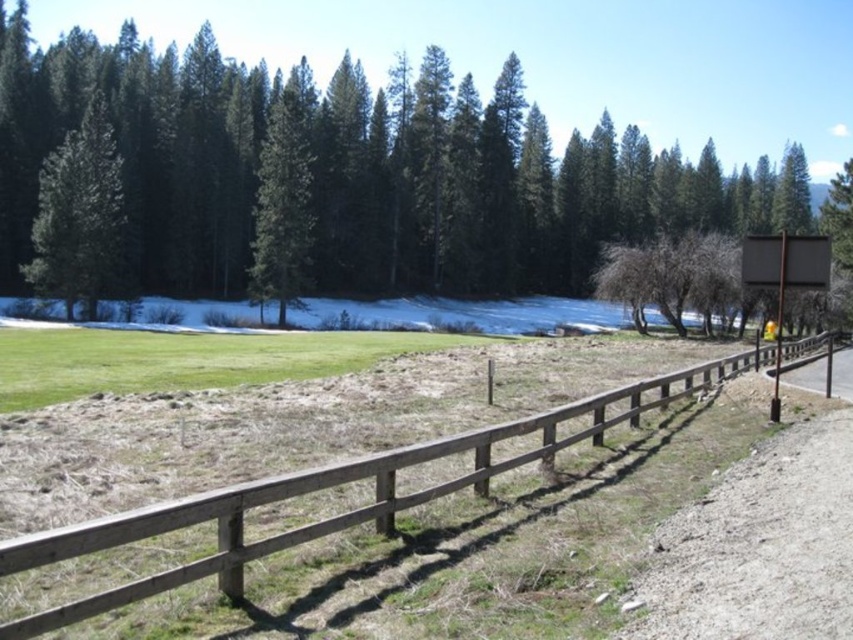
Is green coniferous trees at upper center behind green matte tree at upper left?

That is True.

Measure the distance between point (57, 134) and camera.

Point (57, 134) and camera are 101.29 meters apart from each other.

Where is `green coniferous trees at upper center`? The width and height of the screenshot is (853, 640). green coniferous trees at upper center is located at coordinates (500, 188).

The image size is (853, 640). Find the location of `green coniferous trees at upper center`. green coniferous trees at upper center is located at coordinates (500, 188).

Does green matte tree at upper left have a greater height compared to green matte tree at center?

No, green matte tree at upper left is not taller than green matte tree at center.

Is green matte tree at upper left wider than green matte tree at center?

Indeed, green matte tree at upper left has a greater width compared to green matte tree at center.

Who is more distant from viewer, (64,157) or (300,188)?

Positioned behind is point (300,188).

In order to click on green matte tree at upper left in this screenshot , I will do `click(79, 216)`.

Does green coniferous trees at upper center have a lesser height compared to green matte tree at center?

No, green coniferous trees at upper center is not shorter than green matte tree at center.

Does green coniferous trees at upper center have a greater height compared to green matte tree at center?

Correct, green coniferous trees at upper center is much taller as green matte tree at center.

Measure the distance between point (36, 186) and camera.

97.19 meters

Where is `green coniferous trees at upper center`? green coniferous trees at upper center is located at coordinates (500, 188).